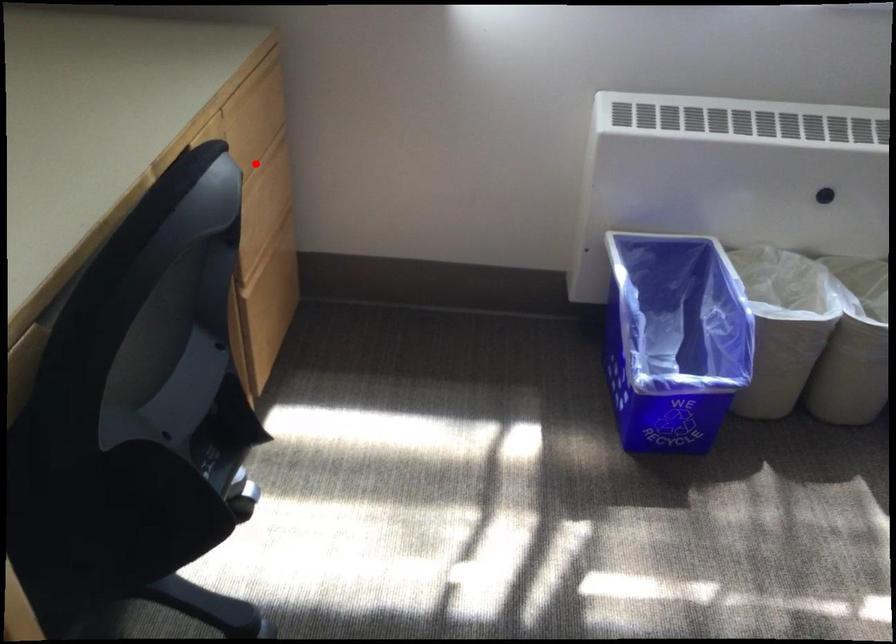
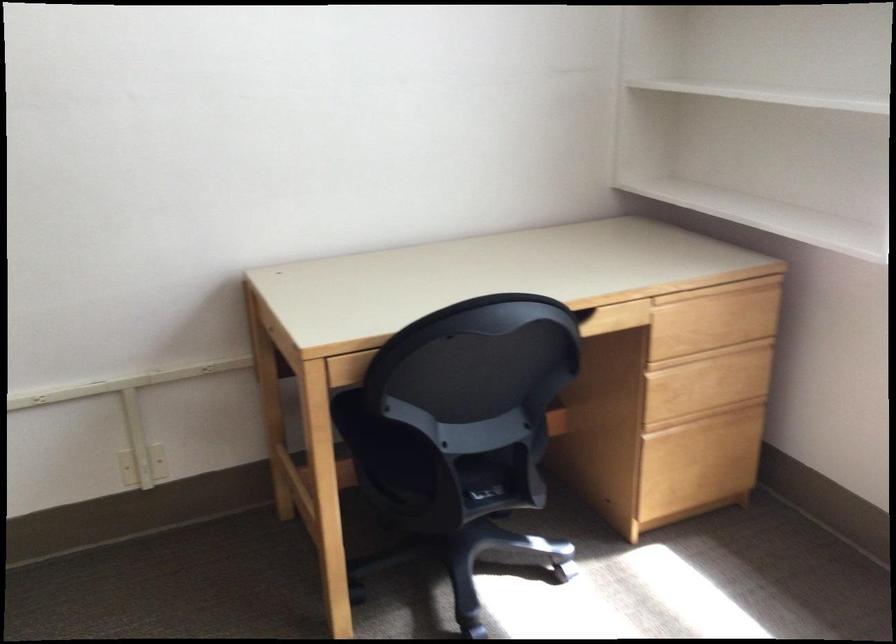
Question: I am providing you with two images of the same scene from different viewpoints. In image1, a red point is highlighted. Considering the same 3D point in image2, which of the following is correct?

Choices:
 (A) It is closer
 (B) It is farther

Answer: (B)